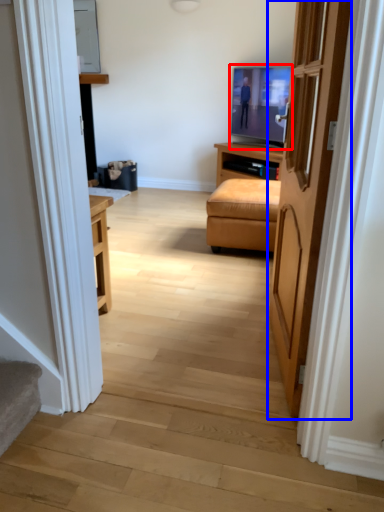
Question: Which object is closer to the camera taking this photo, television (highlighted by a red box) or door (highlighted by a blue box)?

Choices:
 (A) television
 (B) door

Answer: (B)